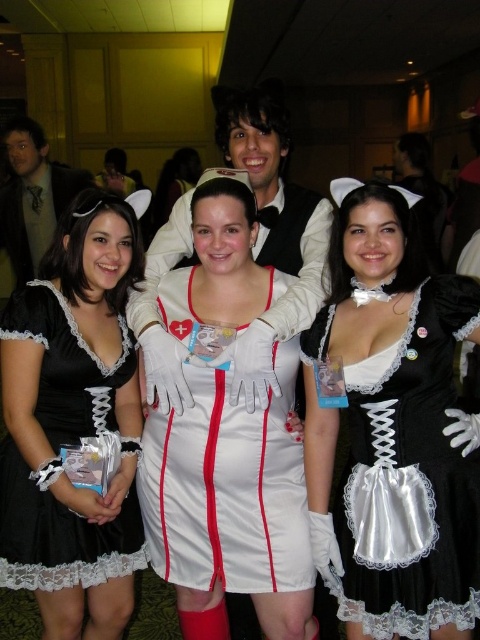
Is white satin dress at center taller than matte black vest at center?

No.

Does white satin dress at center appear over matte black vest at center?

Incorrect, white satin dress at center is not positioned above matte black vest at center.

Is point (252, 563) closer to viewer compared to point (243, 140)?

Yes, point (252, 563) is closer to viewer.

The image size is (480, 640). What are the coordinates of `white satin dress at center` in the screenshot? It's located at (227, 486).

What do you see at coordinates (59, 534) in the screenshot? Image resolution: width=480 pixels, height=640 pixels. I see `black satin dress at center` at bounding box center [59, 534].

Locate an element on the screen. The width and height of the screenshot is (480, 640). black satin dress at center is located at coordinates (59, 534).

Describe the element at coordinates (394, 429) in the screenshot. I see `satin black dress at center` at that location.

Which is below, satin black dress at center or matte black vest at center?

satin black dress at center is below.

Is point (479, 500) positioned after point (252, 104)?

No, (479, 500) is closer to viewer.

I want to click on satin black dress at center, so click(x=394, y=429).